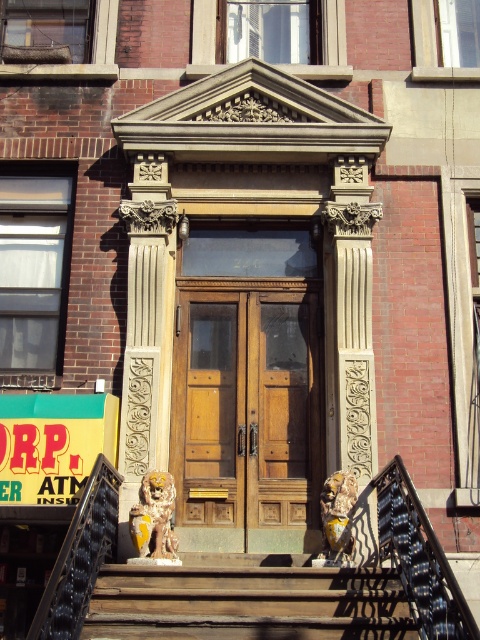
Which of these two, wooden door at center or wooden stairs at center, stands shorter?

With less height is wooden stairs at center.

Does point (222, 378) come behind point (311, 609)?

That is True.

Find the location of a particular element. This screenshot has height=640, width=480. wooden door at center is located at coordinates (248, 413).

Is wooden door at center bigger than white carved stone column at center?

Indeed, wooden door at center has a larger size compared to white carved stone column at center.

Does wooden door at center appear on the right side of white carved stone column at center?

Yes, wooden door at center is to the right of white carved stone column at center.

Describe the element at coordinates (248, 413) in the screenshot. The width and height of the screenshot is (480, 640). I see `wooden door at center` at that location.

You are a GUI agent. You are given a task and a screenshot of the screen. Output one action in this format:
    pyautogui.click(x=<x>, y=<y>)
    Task: Click on the wooden door at center
    
    Given the screenshot: What is the action you would take?
    pyautogui.click(x=248, y=413)

Can you confirm if white carved stone column at center is taller than yellow plastic atm sign at lower left?

Indeed, white carved stone column at center has a greater height compared to yellow plastic atm sign at lower left.

Between white carved stone column at center and yellow plastic atm sign at lower left, which one has less height?

With less height is yellow plastic atm sign at lower left.

Who is more forward, (130, 547) or (62, 451)?

Point (62, 451) is more forward.

The image size is (480, 640). In order to click on white carved stone column at center in this screenshot , I will do `click(144, 330)`.